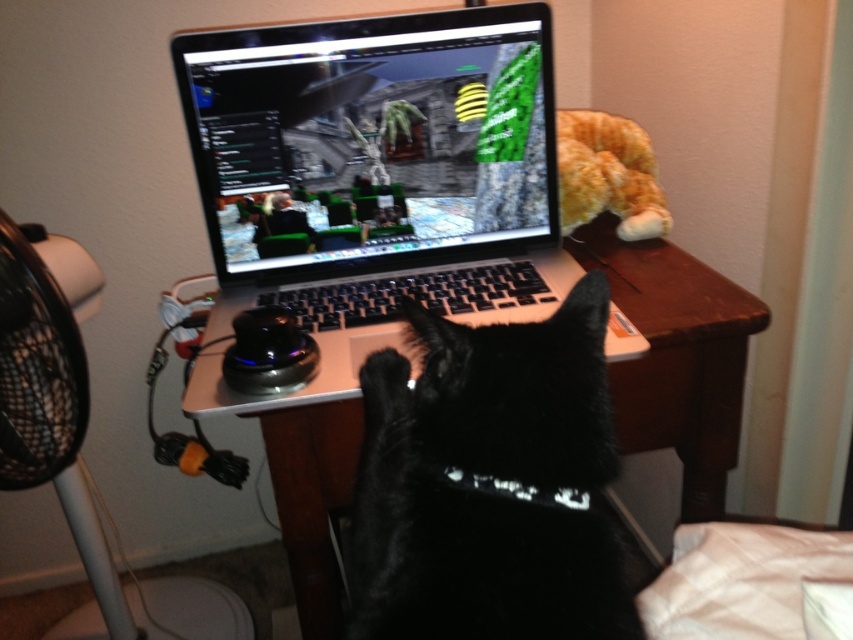
Question: Which point is closer to the camera taking this photo?

Choices:
 (A) [335, 612]
 (B) [62, 490]
 (C) [610, 211]
 (D) [405, 573]

Answer: (D)

Question: Does white wood computer desk at center lie in front of black plastic fan at left?

Choices:
 (A) yes
 (B) no

Answer: (B)

Question: Can you confirm if white wood computer desk at center is positioned above black plastic fan at left?

Choices:
 (A) no
 (B) yes

Answer: (B)

Question: Among these points, which one is nearest to the camera?

Choices:
 (A) (531, 518)
 (B) (9, 404)

Answer: (A)

Question: Is black fur cat at center above white wood computer desk at center?

Choices:
 (A) yes
 (B) no

Answer: (B)

Question: Considering the real-world distances, which object is closest to the black fur cat at center?

Choices:
 (A) orange plush at upper right
 (B) white wood computer desk at center

Answer: (B)